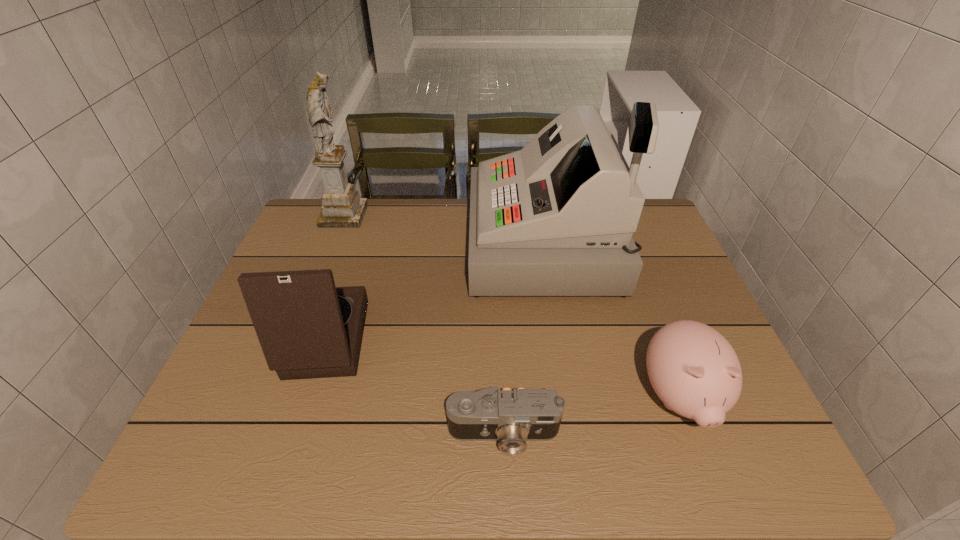
I want to click on cash register, so click(x=556, y=218).

Identify the location of sculpture. (342, 207).

I want to click on phonograph record, so tap(307, 328).

This screenshot has height=540, width=960. Identify the location of piggy bank. (693, 369).

Where is `the shortest object`? This screenshot has height=540, width=960. the shortest object is located at coordinates (512, 417).

Identify the location of free location located on the keypad side of the cash register. (353, 244).

The height and width of the screenshot is (540, 960). I want to click on free point located 0.240m on the keypad side of the cash register, so click(392, 244).

The height and width of the screenshot is (540, 960). Find the location of `blank area located on the keypad side of the cash register`. blank area located on the keypad side of the cash register is located at coordinates (424, 244).

Where is `blank space located 0.330m on the front-facing side of the sculpture`? This screenshot has width=960, height=540. blank space located 0.330m on the front-facing side of the sculpture is located at coordinates (464, 215).

The height and width of the screenshot is (540, 960). I want to click on free spot located on the right of the third tallest object, so click(492, 340).